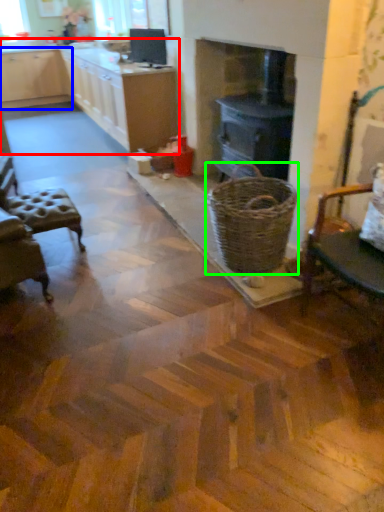
Question: Which object is positioned farthest from cabinetry (highlighted by a red box)? Select from cabinetry (highlighted by a blue box) and basket (highlighted by a green box).

Choices:
 (A) cabinetry
 (B) basket

Answer: (B)